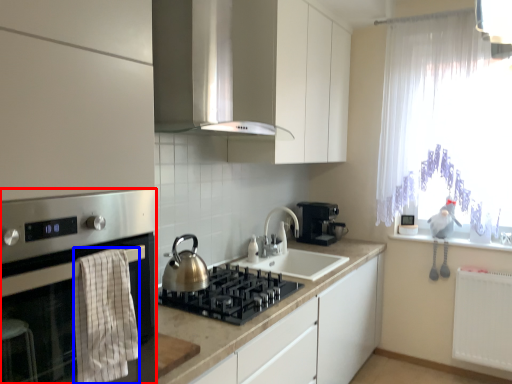
Question: Which object appears closest to the camera in this image, home appliance (highlighted by a red box) or blanket (highlighted by a blue box)?

Choices:
 (A) home appliance
 (B) blanket

Answer: (A)